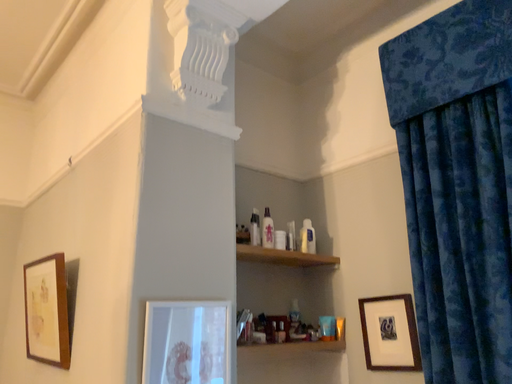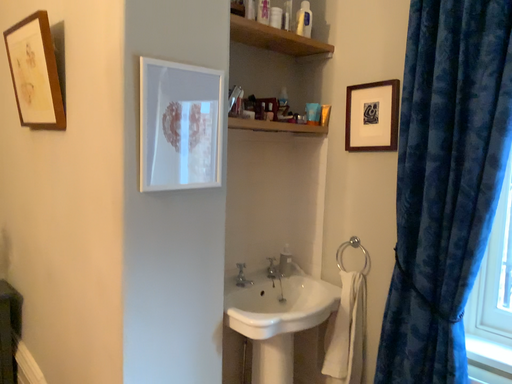
Question: Which way did the camera rotate in the video?

Choices:
 (A) rotated upward
 (B) rotated downward

Answer: (B)